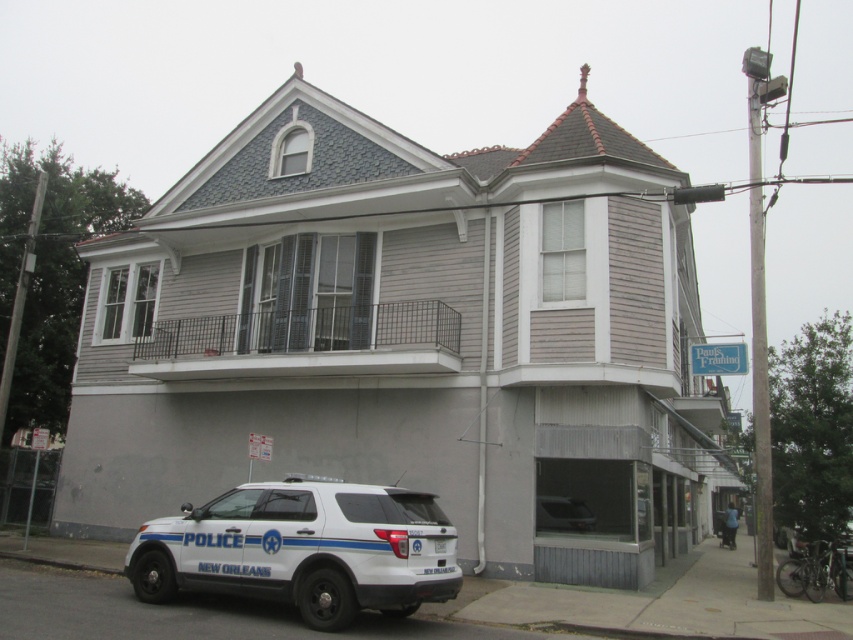
You are a pedestrian standing on the sidewalk in front of the two story building. You see a white matte police car at lower left and a metallic gray sedan at lower center. Which vehicle is positioned closer to the left side of the building?

The white matte police car at lower left is positioned to the left of the metallic gray sedan at lower center, so it is closer to the left side of the building.

You are a delivery person standing at the entrance of the two story building. You need to park your van which is 3 meters wide. Is there enough space between the white matte police car at lower left and the building to park your van?

The white matte police car at lower left is positioned at point (305, 548), but without knowing the exact dimensions of the space between the car and the building, it is impossible to determine if there is enough room for a 3 meter wide van. Additional information about the available space is required to make an accurate assessment.